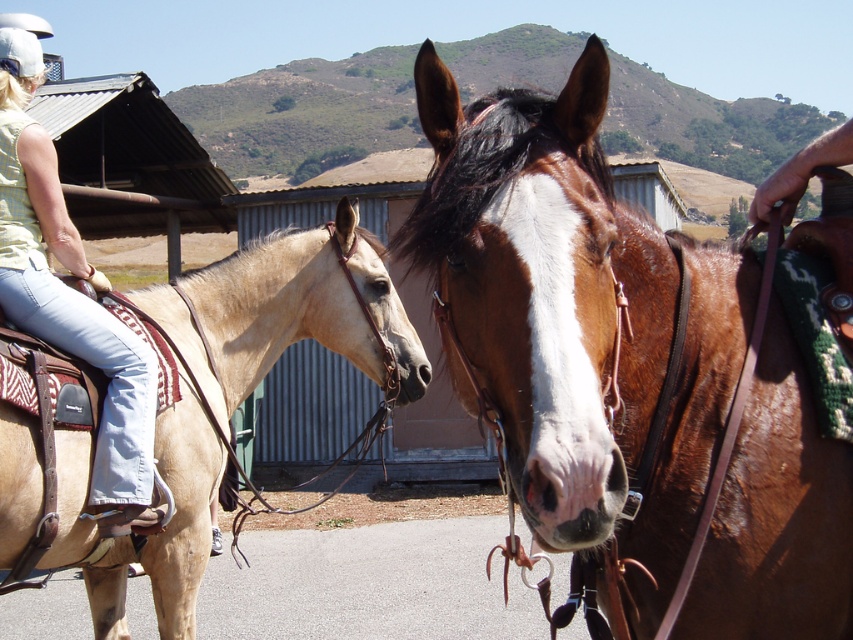
Can you confirm if brown glossy horse at center is positioned to the right of denim jeans at left?

Yes, brown glossy horse at center is to the right of denim jeans at left.

Does brown glossy horse at center have a lesser height compared to denim jeans at left?

Yes.

Is point (630, 419) in front of point (149, 385)?

Yes, point (630, 419) is in front of point (149, 385).

Identify the location of brown glossy horse at center. (576, 321).

Can you confirm if brown glossy horse at center is positioned below light tan leather saddle at left?

No.

Which of these two, brown glossy horse at center or light tan leather saddle at left, stands taller?

Standing taller between the two is light tan leather saddle at left.

Is point (596, 44) in front of point (74, 529)?

Yes, point (596, 44) is closer to viewer.

You are a GUI agent. You are given a task and a screenshot of the screen. Output one action in this format:
    pyautogui.click(x=<x>, y=<y>)
    Task: Click on the brown glossy horse at center
    This screenshot has width=853, height=640.
    Given the screenshot: What is the action you would take?
    pos(576,321)

Can you confirm if light tan leather saddle at left is positioned to the right of denim jeans at left?

Yes, light tan leather saddle at left is to the right of denim jeans at left.

Is point (264, 342) positioned in front of point (64, 296)?

No, (264, 342) is behind (64, 296).

This screenshot has height=640, width=853. Identify the location of light tan leather saddle at left. (289, 310).